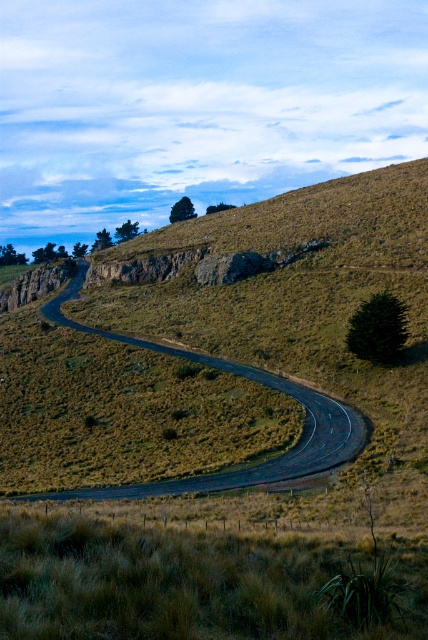
You are a hiker planning to walk from the dry grass at lower left to the black asphalt road at center. Which direction should you move to reach the road without crossing the road itself?

The dry grass at lower left is in front of the black asphalt road at center, so you should move forward towards the road to reach it without crossing it.

You are driving a car and see two points on the road ahead. The first point is at coordinates point (199,586) and the second point is at point (183,353). Based on the scene, which point is closer to your current position?

Point (199,586) is in front of point (183,353), so the point closer to your current position is point (199,586).